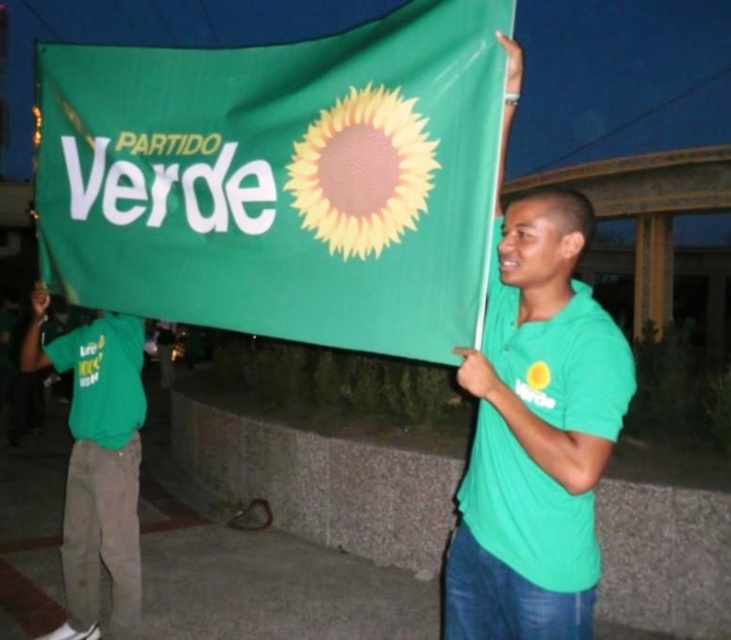
You are standing at the point with coordinates point [129,573] and want to walk to the point with coordinates point [602,372]. Which direction should you move?

You should move forward because point [602,372] is in front of point [129,573].

You are standing in front of the green fabric flag at center and want to reach a button on the flagpole that is 6 feet above the ground. Can you reach it without a ladder?

The green fabric flag at center is 5.26 feet from viewer, so the distance to the button is more than 5.26 feet. You need a ladder to reach it.

You are organizing a nighttime event and need to ensure the green fabric flag at center can be displayed without overlapping the green matte shirt at center. Based on the scene description, can you confirm if there is enough space between them for proper display?

The green fabric flag at center might be wider than green matte shirt at center, so there may not be enough space between them for proper display without overlapping.